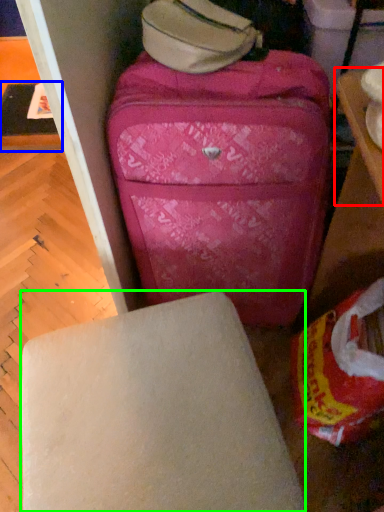
Question: Which is farther away from table (highlighted by a red box)? table (highlighted by a blue box) or furniture (highlighted by a green box)?

Choices:
 (A) table
 (B) furniture

Answer: (A)